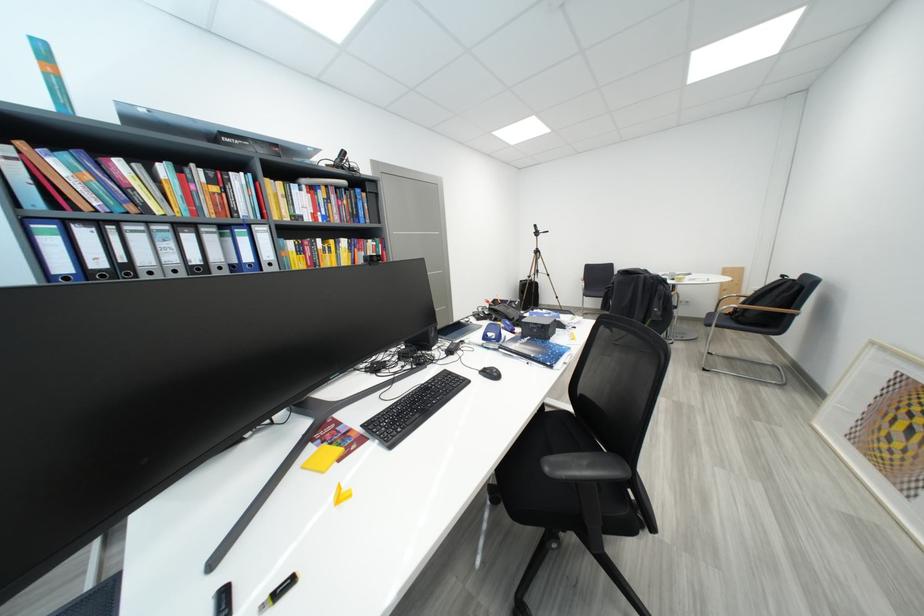
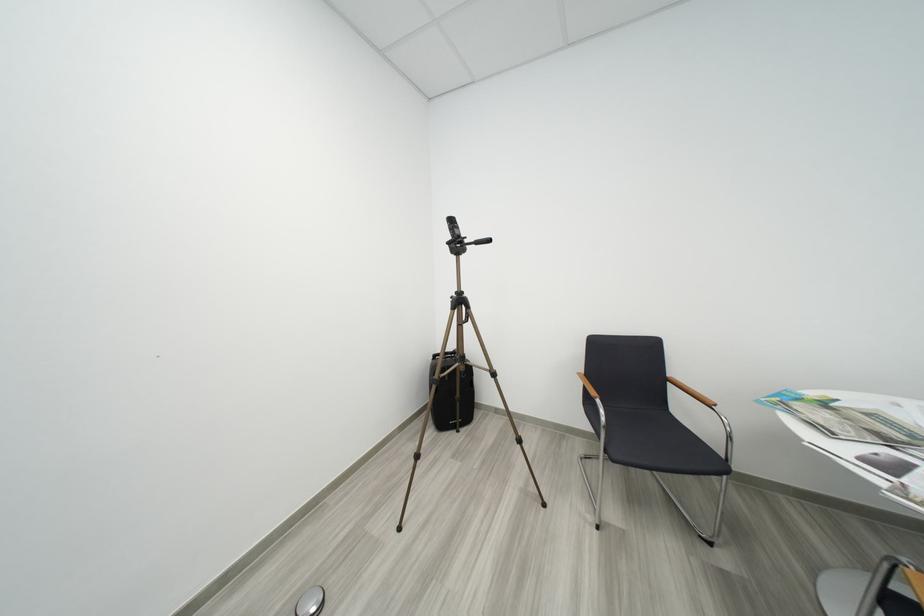
In a continuous first-person perspective shot, in which direction is the camera moving?

The cameraman walked toward right, forward.